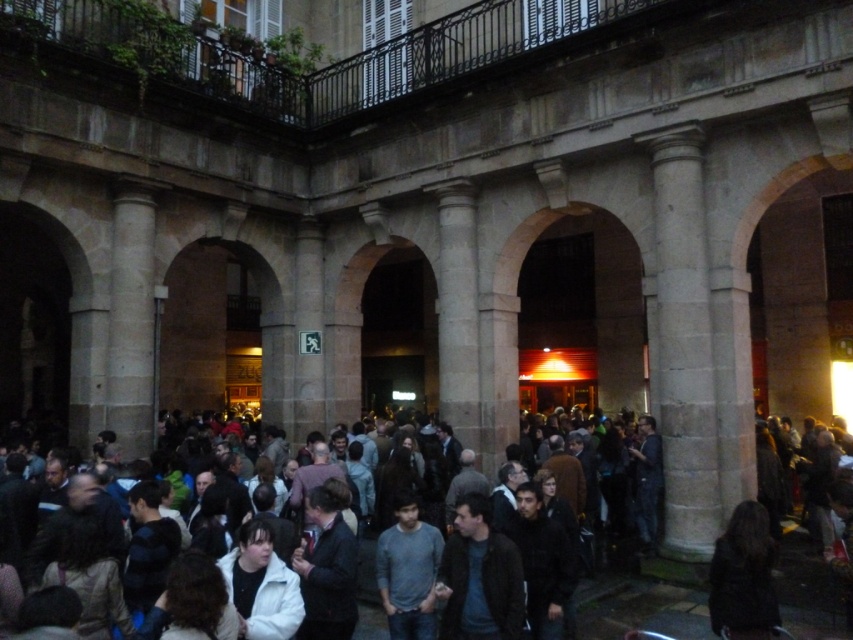
Question: In this image, where is dark clothing crowd at center located relative to gray cotton shirt at center?

Choices:
 (A) below
 (B) above

Answer: (B)

Question: Among these objects, which one is nearest to the camera?

Choices:
 (A) gray cotton shirt at center
 (B) dark clothing crowd at center

Answer: (B)

Question: Can you confirm if dark clothing crowd at center is thinner than gray cotton shirt at center?

Choices:
 (A) yes
 (B) no

Answer: (B)

Question: Is dark clothing crowd at center positioned at the back of gray cotton shirt at center?

Choices:
 (A) no
 (B) yes

Answer: (A)

Question: Which point is closer to the camera?

Choices:
 (A) dark clothing crowd at center
 (B) gray cotton shirt at center

Answer: (A)

Question: Which point is closer to the camera?

Choices:
 (A) (177, 417)
 (B) (387, 557)

Answer: (B)